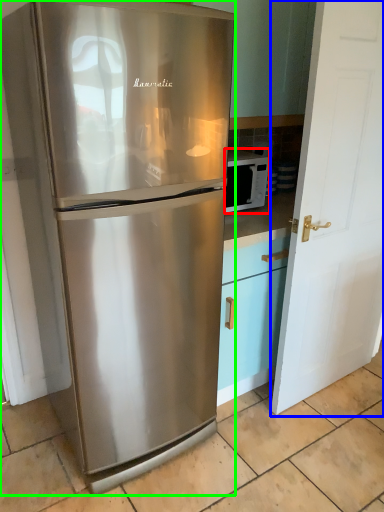
Question: Which object is the closest to the microwave oven (highlighted by a red box)? Choose among these: door (highlighted by a blue box) or refrigerator (highlighted by a green box).

Choices:
 (A) door
 (B) refrigerator

Answer: (A)